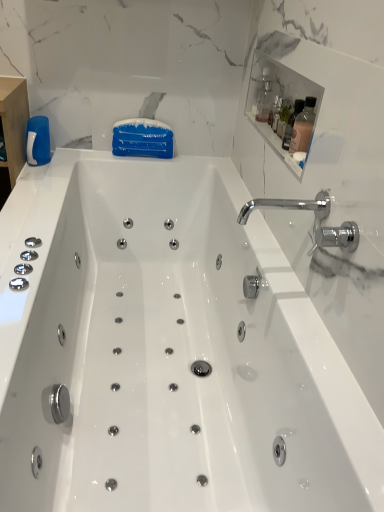
The height and width of the screenshot is (512, 384). Find the location of `vacant region to the right of blue glossy bottle at left`. vacant region to the right of blue glossy bottle at left is located at coordinates (72, 160).